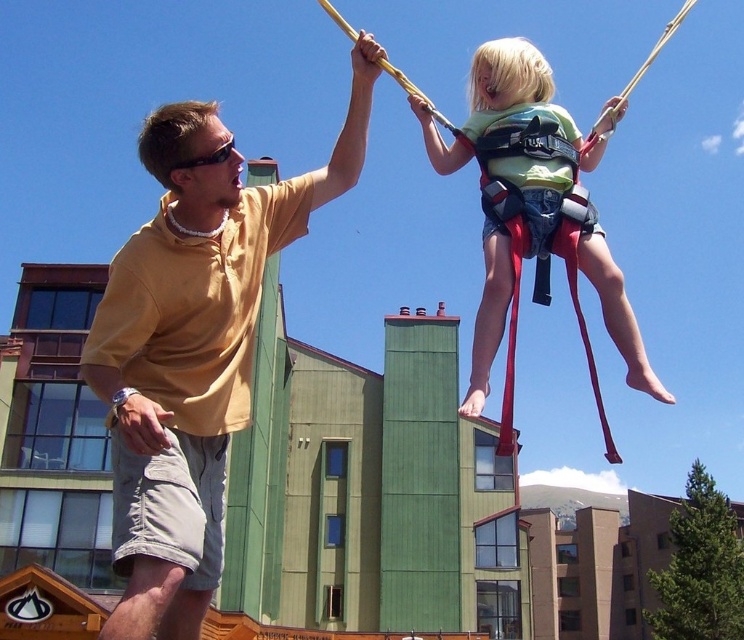
Can you confirm if green fabric harness at upper center is smaller than black plastic goggles at upper center?

No, green fabric harness at upper center is not smaller than black plastic goggles at upper center.

Identify the location of green fabric harness at upper center. The image size is (744, 640). (513, 90).

Does point (541, 192) come farther from viewer compared to point (202, 163)?

That is True.

Where is `green fabric harness at upper center`? The height and width of the screenshot is (640, 744). green fabric harness at upper center is located at coordinates (513, 90).

Who is taller, matte yellow shirt at center or green fabric harness at upper center?

matte yellow shirt at center is taller.

Find the location of a particular element. The width and height of the screenshot is (744, 640). matte yellow shirt at center is located at coordinates (193, 348).

Is point (158, 612) positioned after point (193, 157)?

No, it is not.

I want to click on matte yellow shirt at center, so click(193, 348).